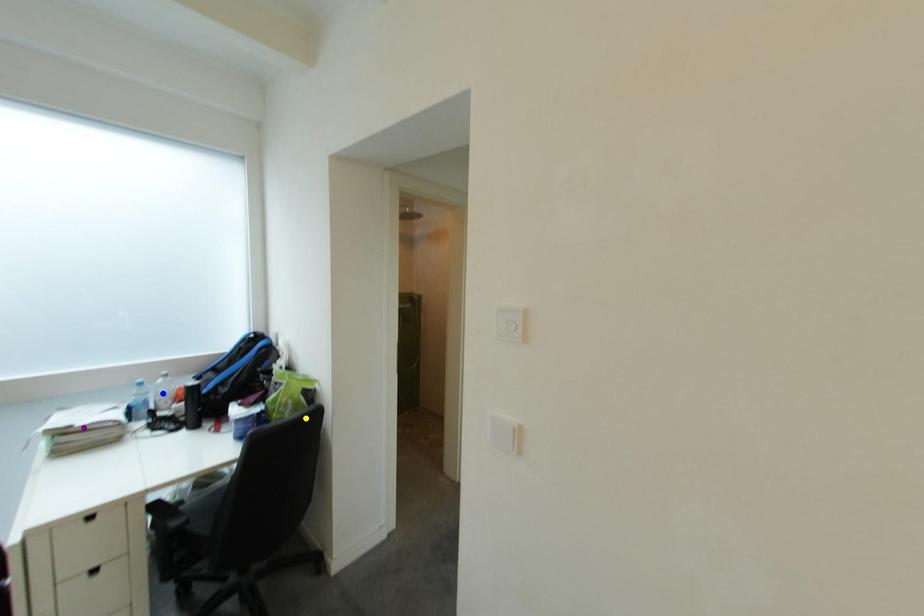
Order these from nearest to farthest:
yellow point | purple point | blue point

blue point
yellow point
purple point